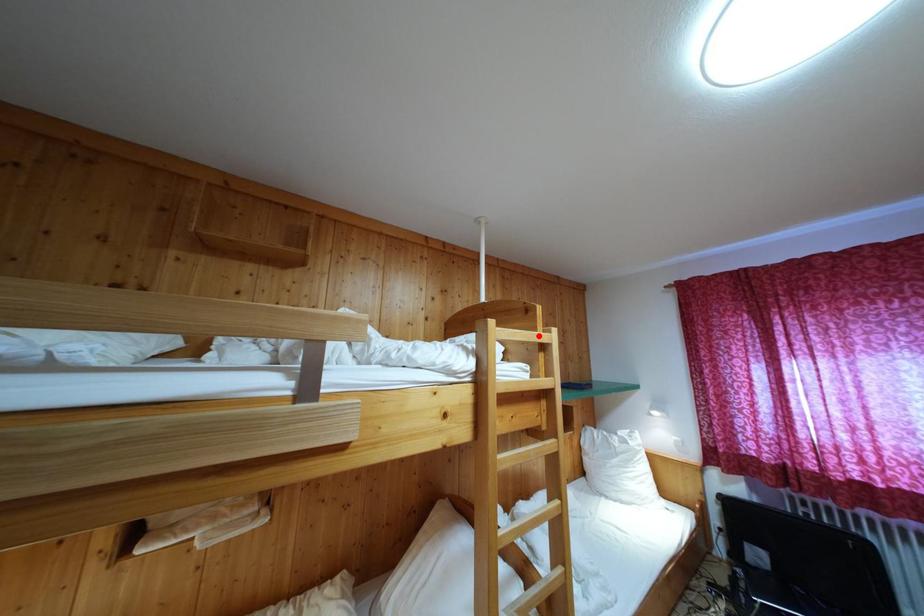
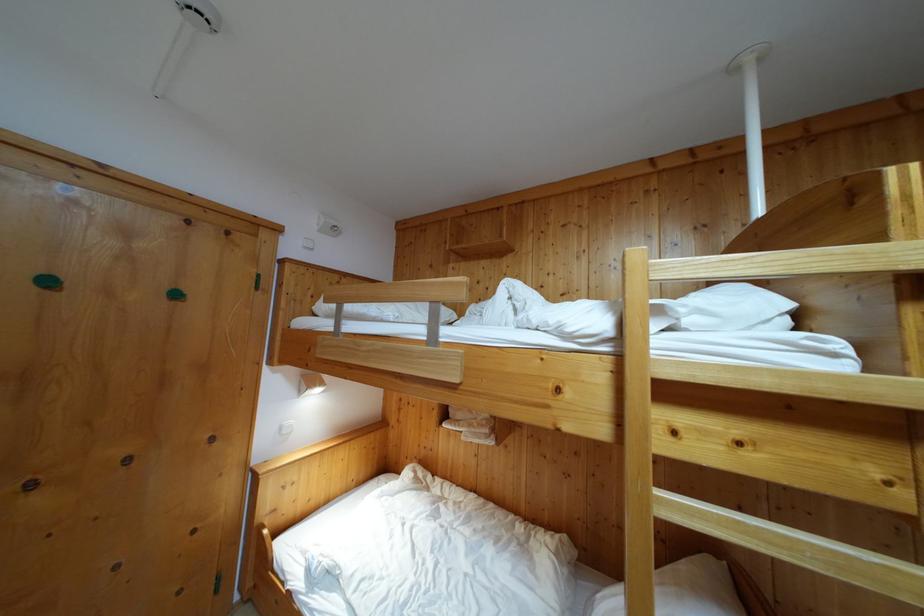
Where in the second image is the point corresponding to the highlighted location from the first image?

(881, 245)